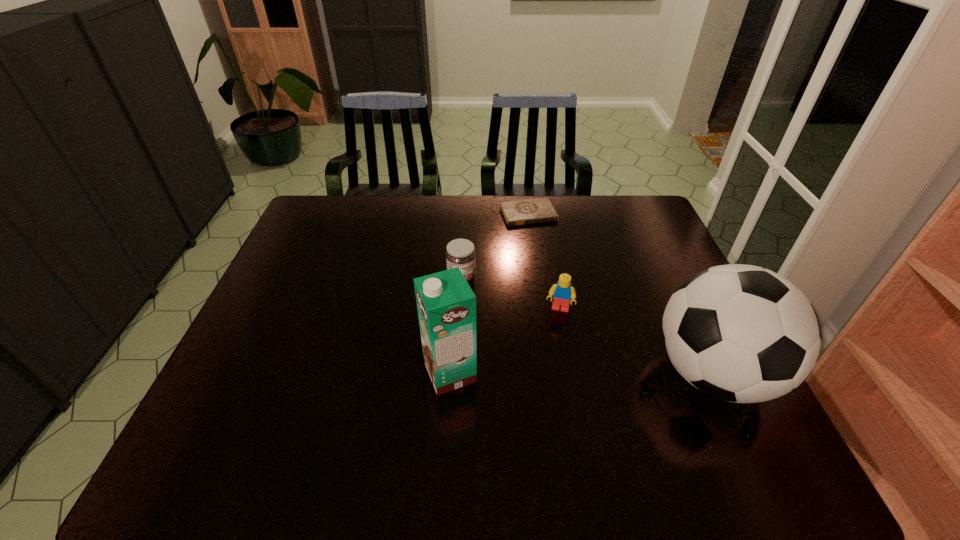
Identify the location of vacant area that lies between the fourth nearest object and the diary. This screenshot has height=540, width=960. [x=495, y=246].

You are a GUI agent. You are given a task and a screenshot of the screen. Output one action in this format:
    pyautogui.click(x=<x>, y=<y>)
    Task: Click on the blank region between the third nearest object and the farthest object
    The width and height of the screenshot is (960, 540).
    Given the screenshot: What is the action you would take?
    pyautogui.click(x=543, y=262)

Where is `vacant space that is in between the carton and the rightmost object`? vacant space that is in between the carton and the rightmost object is located at coordinates (582, 373).

Find the location of `free area in between the carton and the farthest object`. free area in between the carton and the farthest object is located at coordinates (490, 293).

Find the location of a particular element. This screenshot has height=540, width=960. empty location between the Lego and the diary is located at coordinates (543, 262).

Find the location of `the closest object relative to the third nearest object`. the closest object relative to the third nearest object is located at coordinates (741, 333).

In order to click on object that ranks as the second closest to the third nearest object in this screenshot , I will do `click(460, 253)`.

The width and height of the screenshot is (960, 540). I want to click on free space that satisfies the following two spatial constraints: 1. on the front side of the third farthest object; 2. on the right side of the diary, so click(x=542, y=310).

I want to click on vacant point that satisfies the following two spatial constraints: 1. on the front side of the third farthest object; 2. on the left side of the farthest object, so click(x=542, y=310).